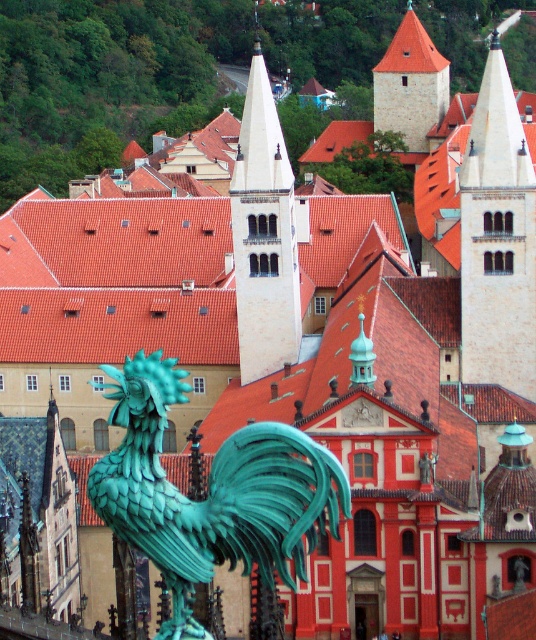
Can you confirm if green patina rooster at center is thinner than smooth beige tower at center?

No.

Between point (281, 452) and point (236, 221), which one is positioned in front?

Point (281, 452)

Find the location of a particular element. Image resolution: width=536 pixels, height=640 pixels. green patina rooster at center is located at coordinates (211, 492).

Does smooth stone tower at upper right appear under brown stone tower at upper center?

Correct, smooth stone tower at upper right is located below brown stone tower at upper center.

Between smooth stone tower at upper right and brown stone tower at upper center, which one appears on the right side from the viewer's perspective?

From the viewer's perspective, smooth stone tower at upper right appears more on the right side.

Which is behind, point (464, 380) or point (414, 93)?

Positioned behind is point (414, 93).

Where is `smooth stone tower at upper right`? This screenshot has height=640, width=536. smooth stone tower at upper right is located at coordinates (497, 240).

Does smooth stone tower at upper right have a larger size compared to smooth beige tower at center?

Yes.

Between smooth stone tower at upper right and smooth beige tower at center, which one has less height?

Standing shorter between the two is smooth stone tower at upper right.

Does point (472, 372) come closer to viewer compared to point (251, 240)?

No, it is behind (251, 240).

Locate an element on the screen. smooth stone tower at upper right is located at coordinates (497, 240).